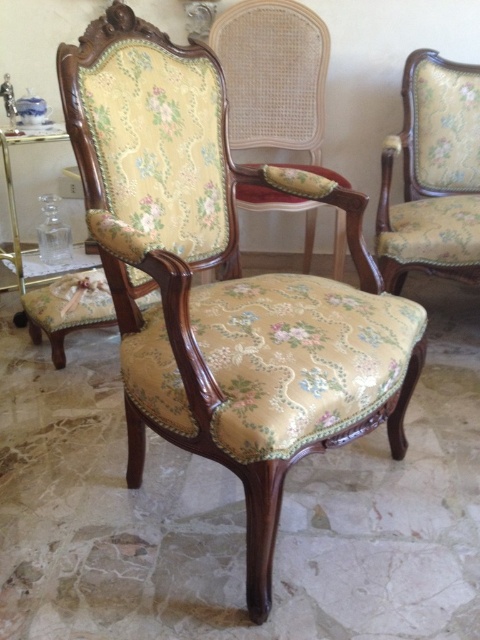
Question: Among these points, which one is farthest from the camera?

Choices:
 (A) (216, 1)
 (B) (37, 298)

Answer: (A)

Question: Can you confirm if floral fabric armchair at center is positioned above floral fabric stool at center?

Choices:
 (A) no
 (B) yes

Answer: (B)

Question: Which object appears farthest from the camera in this image?

Choices:
 (A) matte glass lampshade at upper center
 (B) floral fabric armchair at center

Answer: (A)

Question: Can you confirm if floral fabric armchair at center is wider than floral fabric stool at center?

Choices:
 (A) no
 (B) yes

Answer: (B)

Question: Among these points, which one is nearest to the camera?

Choices:
 (A) (206, 35)
 (B) (302, 129)
 (C) (40, 337)

Answer: (C)

Question: Does floral fabric armchair at center have a lesser width compared to matte glass lampshade at upper center?

Choices:
 (A) yes
 (B) no

Answer: (B)